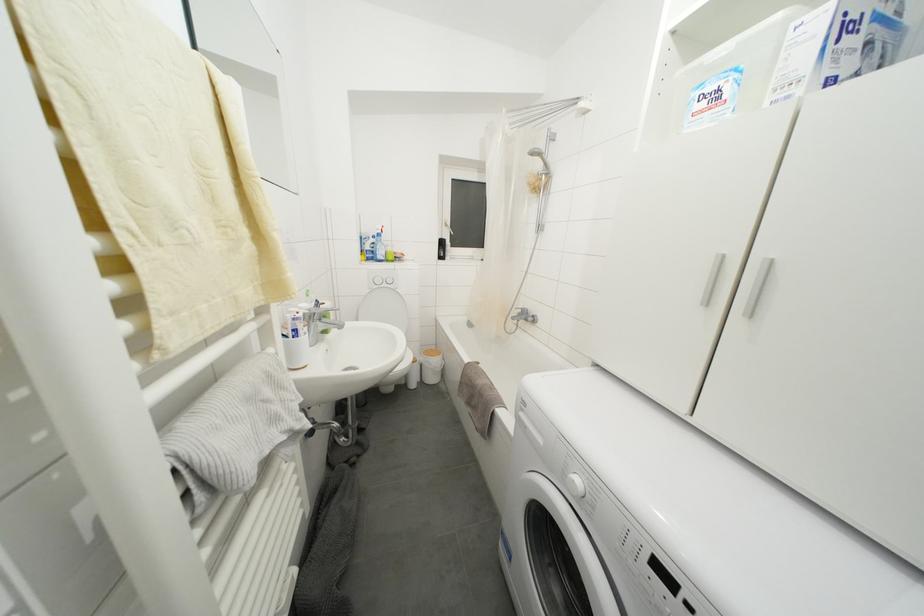
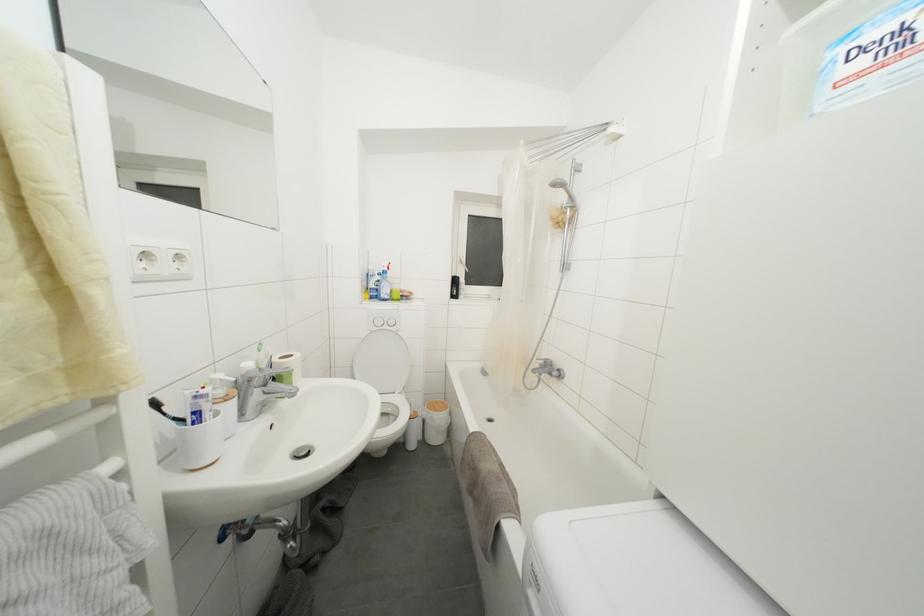
The point at (388, 290) is marked in the first image. Where is the corresponding point in the second image?

(390, 331)